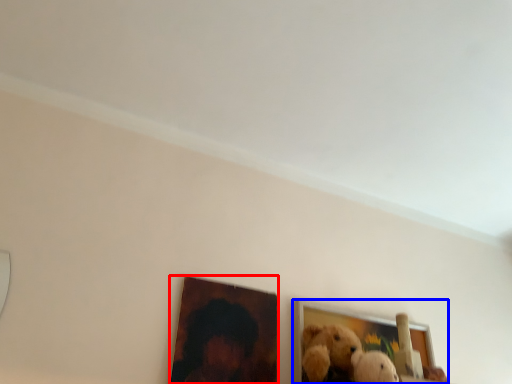
Question: Which point is closer to the camera, picture frame (highlighted by a red box) or picture frame (highlighted by a blue box)?

Choices:
 (A) picture frame
 (B) picture frame

Answer: (A)